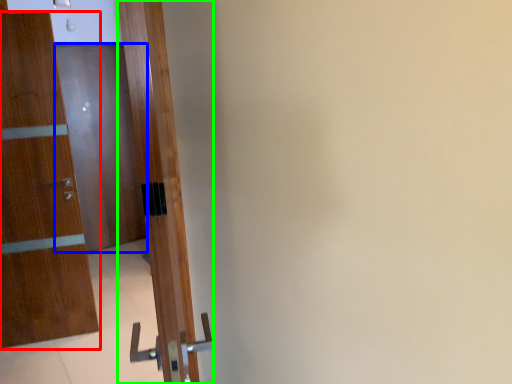
Question: Which is farther away from door (highlighted by a red box)? door (highlighted by a blue box) or door (highlighted by a green box)?

Choices:
 (A) door
 (B) door

Answer: (A)